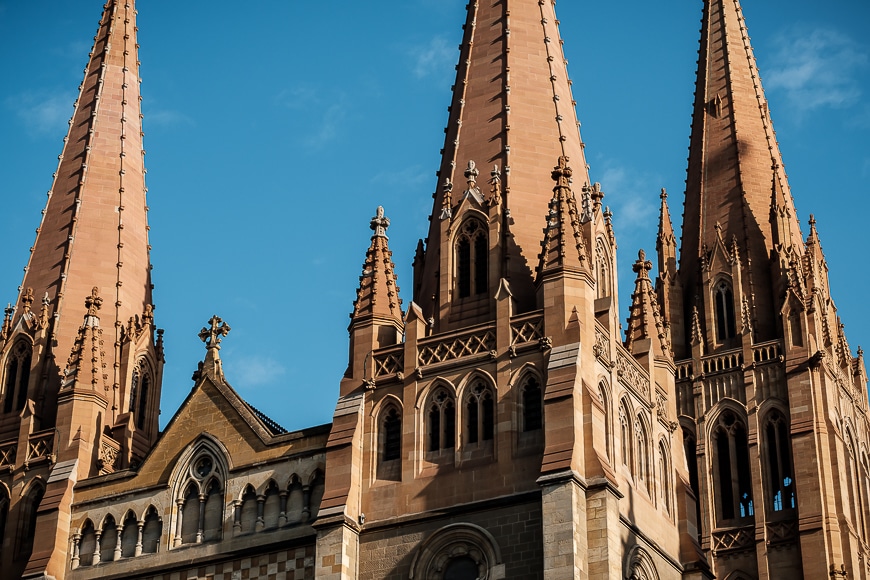
The width and height of the screenshot is (870, 580). Find the location of `window`. window is located at coordinates (472, 422), (480, 422), (523, 416), (465, 263), (479, 261).